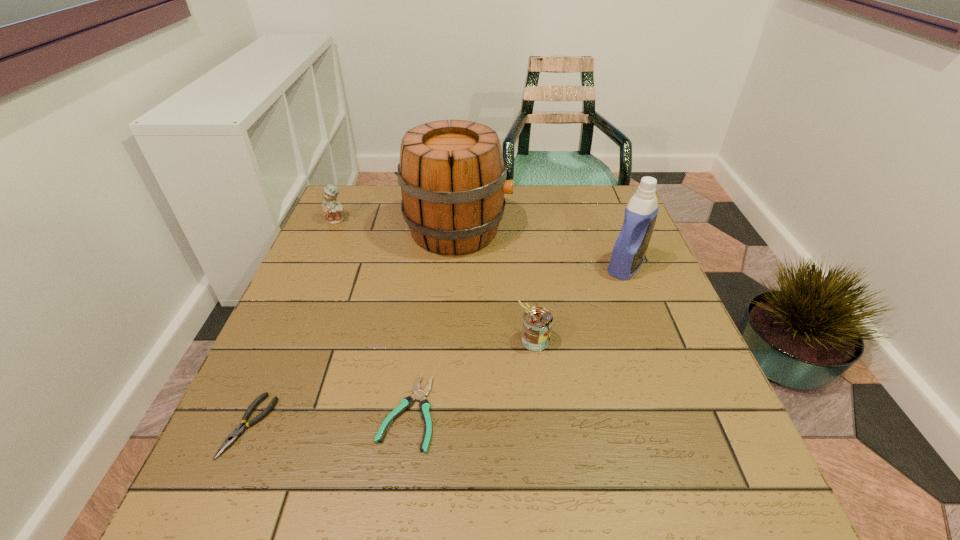
Where is `vacant space at the far edge of the desktop`? This screenshot has height=540, width=960. vacant space at the far edge of the desktop is located at coordinates (562, 210).

This screenshot has width=960, height=540. Find the location of `free region at the near edge`. free region at the near edge is located at coordinates (311, 487).

Where is `free point at the left edge`? free point at the left edge is located at coordinates (347, 245).

Find the location of a particular element. vacant space at the right edge of the desktop is located at coordinates (688, 353).

The width and height of the screenshot is (960, 540). I want to click on vacant point at the far left corner, so click(x=353, y=192).

The image size is (960, 540). I want to click on free space at the far right corner of the desktop, so click(x=576, y=211).

The image size is (960, 540). I want to click on free region at the near right corner, so click(692, 528).

I want to click on free space between the cider and the shortest object, so click(x=432, y=321).

This screenshot has width=960, height=540. Identify the location of empty space that is in between the fourth farthest object and the shorter pliers. (471, 376).

The width and height of the screenshot is (960, 540). What are the coordinates of `empty space that is in between the third nearest object and the cider` in the screenshot? It's located at pyautogui.click(x=496, y=285).